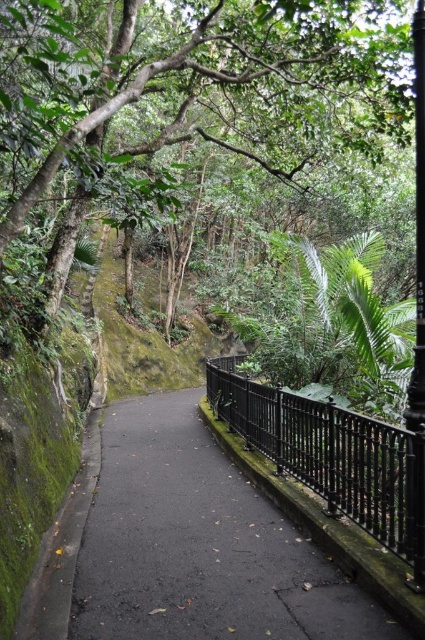
You are standing on the pathway in the forest and see two points marked on the image. The first point is at coordinate point (351, 598) and the second is at point (379, 116). Which point is nearer to you?

Point (351, 598) is closer to the viewer than point (379, 116).